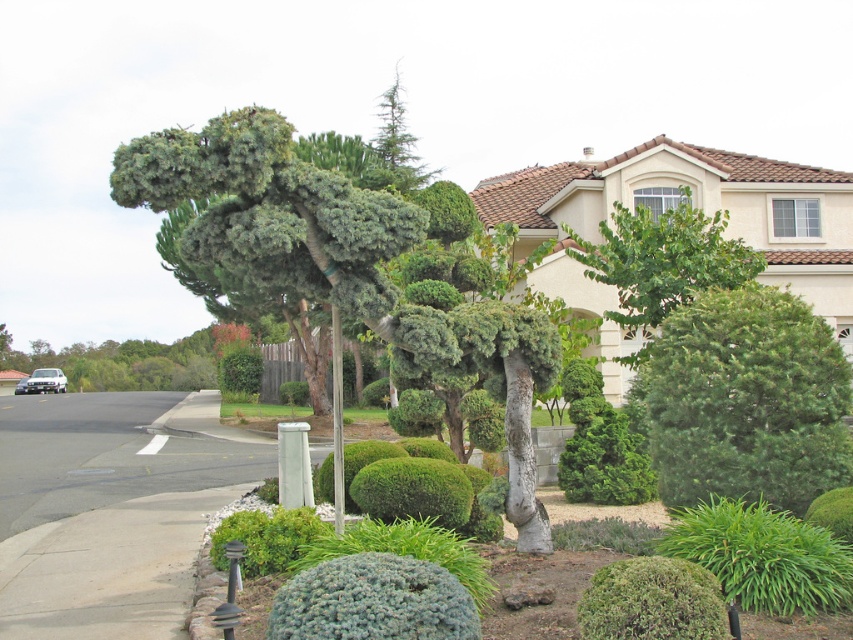
You are a landscape architect planning to install a new pathway between the two points marked as point (376, 241) and point (363, 632). Considering their positions, which point is closer to the viewer where the pathway should start?

Point (376, 241) is further to the viewer than point (363, 632). Therefore, the pathway should start at point (363, 632), which is closer to the viewer, and extend towards point (376, 241).

You are a landscape architect reviewing the suburban landscape design. You need to place a new decorative fountain exactly at the center of the image. Considering the green textured tree at center, will the fountain overlap with it if placed at the image center?

The green textured tree at center is located at point coordinates that are not the exact center of the image, so placing the fountain at the image center will not overlap with it.